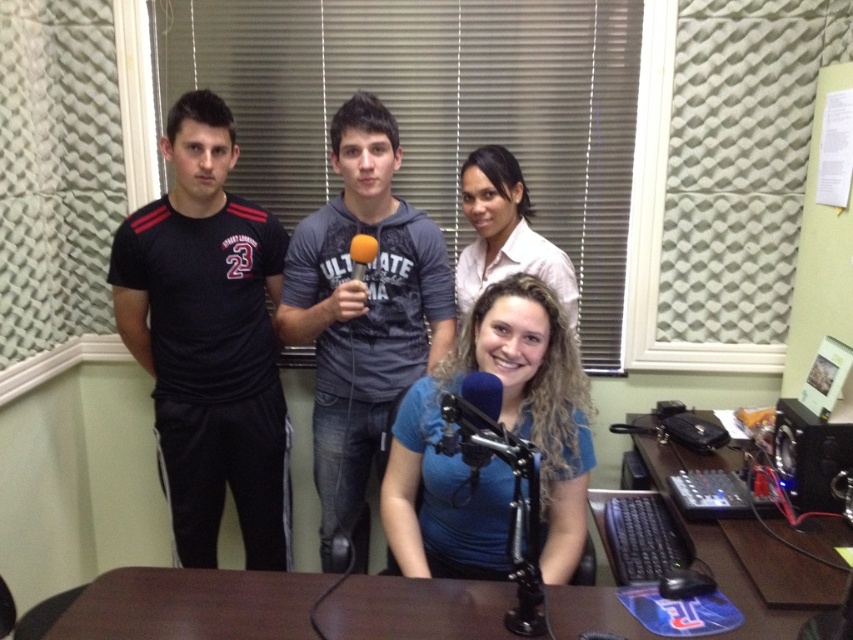
Can you confirm if gray cotton shirt at center is smaller than orange fabric microphone at center?

Actually, gray cotton shirt at center might be larger than orange fabric microphone at center.

Which is in front, point (407, 257) or point (363, 244)?

Point (363, 244) is in front.

Which is behind, point (374, 416) or point (352, 278)?

Point (374, 416)

The height and width of the screenshot is (640, 853). I want to click on gray cotton shirt at center, so click(x=363, y=316).

Between blue matte shirt at center and matte pink shirt at upper center, which one appears on the right side from the viewer's perspective?

matte pink shirt at upper center is more to the right.

How much distance is there between blue matte shirt at center and matte pink shirt at upper center?

The distance of blue matte shirt at center from matte pink shirt at upper center is 16.30 inches.

Is point (564, 438) positioned after point (473, 188)?

No, it is not.

The height and width of the screenshot is (640, 853). Find the location of `blue matte shirt at center`. blue matte shirt at center is located at coordinates tap(492, 460).

Which is more to the left, gray cotton shirt at center or blue matte shirt at center?

gray cotton shirt at center is more to the left.

Consider the image. Who is lower down, gray cotton shirt at center or blue matte shirt at center?

Positioned lower is blue matte shirt at center.

Measure the distance between gray cotton shirt at center and camera.

They are 5.66 feet apart.

The height and width of the screenshot is (640, 853). In order to click on gray cotton shirt at center in this screenshot , I will do `click(363, 316)`.